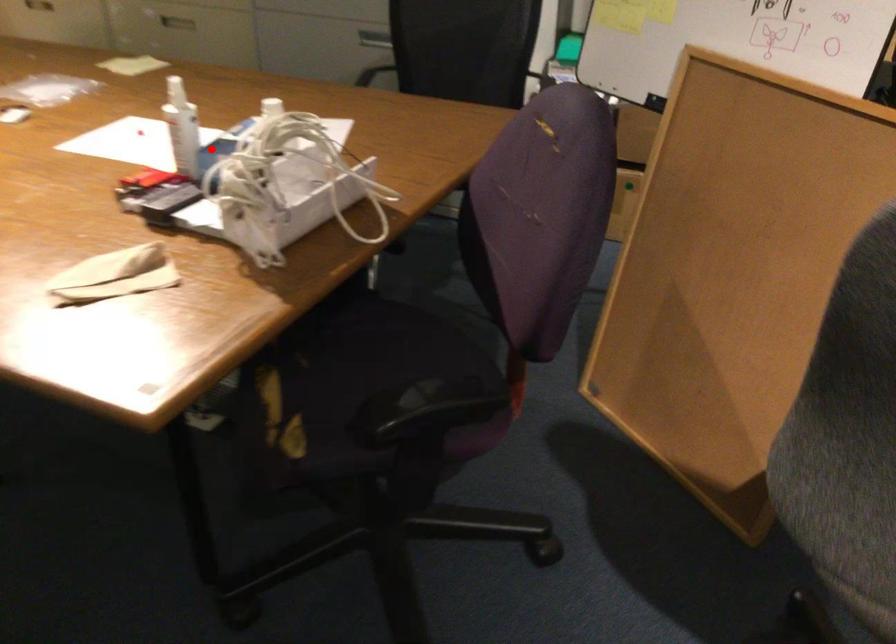
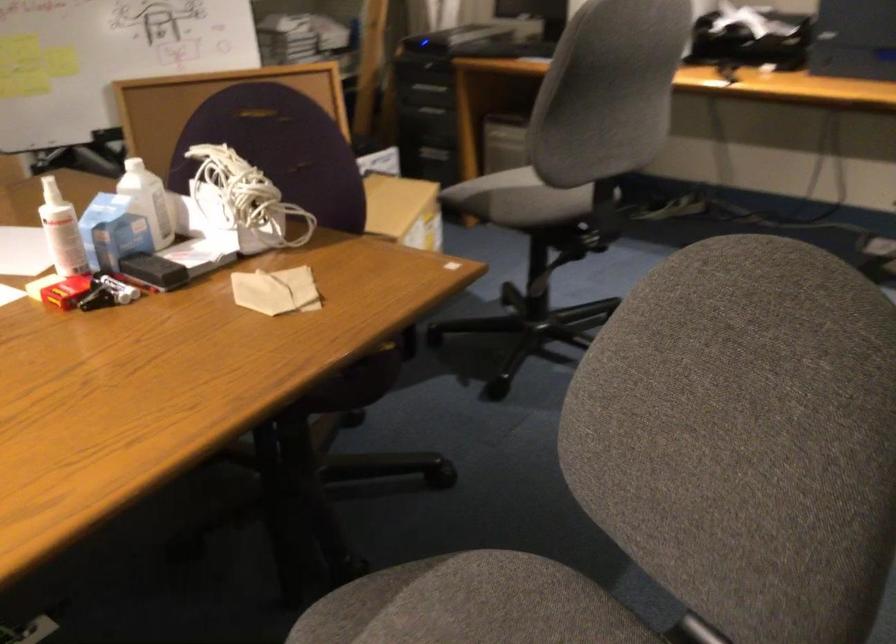
Find the pixel in the second image that matches the highlighted location in the first image.

(114, 225)